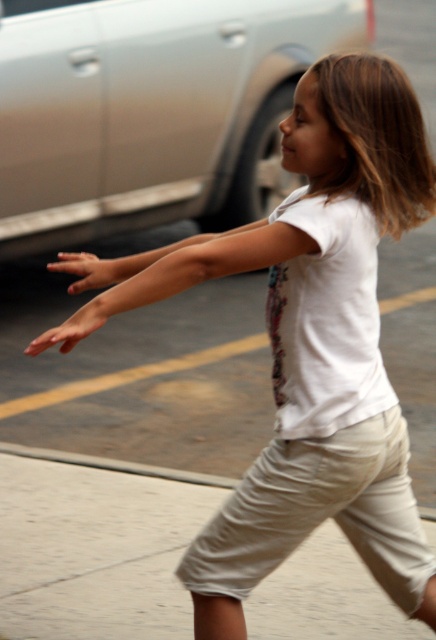
Between brushed metal car at upper left and khaki cotton shorts at lower right, which one has more height?

brushed metal car at upper left is taller.

Does brushed metal car at upper left come behind khaki cotton shorts at lower right?

Yes, it is behind khaki cotton shorts at lower right.

Is point (159, 161) more distant than point (227, 611)?

Yes, point (159, 161) is farther from viewer.

What are the coordinates of `brushed metal car at upper left` in the screenshot? It's located at (150, 109).

Can you confirm if brushed metal car at upper left is positioned above smooth concrete curb at lower center?

Indeed, brushed metal car at upper left is positioned over smooth concrete curb at lower center.

This screenshot has width=436, height=640. Identify the location of brushed metal car at upper left. (150, 109).

Who is more distant from viewer, (23, 237) or (74, 456)?

The point (23, 237) is behind.

The width and height of the screenshot is (436, 640). I want to click on brushed metal car at upper left, so click(x=150, y=109).

Between khaki cotton shorts at lower right and smooth concrete curb at lower center, which one has less height?

smooth concrete curb at lower center

Does khaki cotton shorts at lower right have a lesser width compared to smooth concrete curb at lower center?

Yes, khaki cotton shorts at lower right is thinner than smooth concrete curb at lower center.

Between point (398, 484) and point (422, 506), which one is positioned behind?

Point (422, 506)

The image size is (436, 640). In order to click on khaki cotton shorts at lower right in this screenshot , I will do `click(313, 520)`.